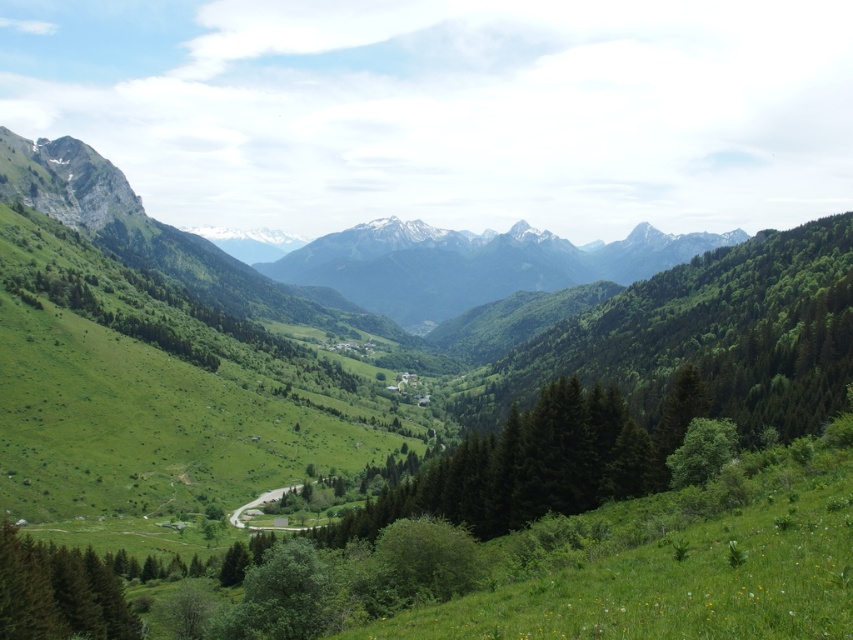
You are an outdoor photographer planning to capture the green forested mountain range at center and the green matte tree at lower left in a single shot. Based on their positions, which object will appear closer to the camera in the final photograph?

The green matte tree at lower left will appear closer to the camera because it is positioned closer to the viewer than the green forested mountain range at center, which is further away.

You are standing at the point marked by the coordinate point at point (148,230). Looking around, you notice the green grassy mountain range. Which direction should you face to see the green grassy mountain range at center?

The green grassy mountain range at center is located at point (148,230), which is your current position. Therefore, you are already at the green grassy mountain range at center, so you can look around in any direction to see it.

You are standing in the valley and want to hike to the highest peak. Which mountain range should you head towards, the green grassy mountain range at center or the green forested mountain range at center?

The green forested mountain range at center has higher peaks since it is farther away than the green grassy mountain range at center, which is closer to the viewer.